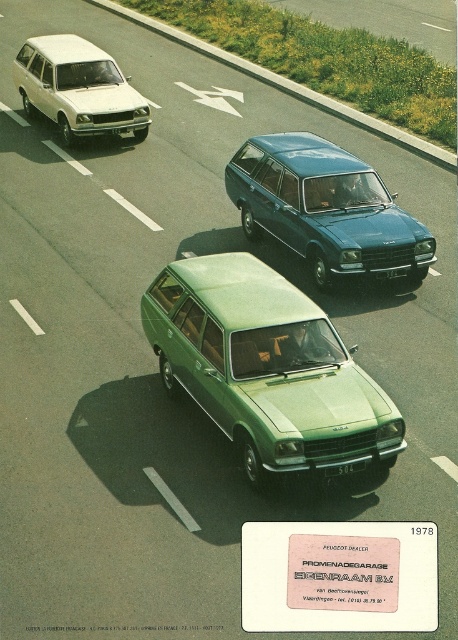
Does teal metallic station wagon at center appear on the left side of matte white station wagon at upper left?

No, teal metallic station wagon at center is not to the left of matte white station wagon at upper left.

Between teal metallic station wagon at center and matte white station wagon at upper left, which one appears on the right side from the viewer's perspective?

Positioned to the right is teal metallic station wagon at center.

Where is `teal metallic station wagon at center`? Image resolution: width=458 pixels, height=640 pixels. teal metallic station wagon at center is located at coordinates (326, 209).

Which is above, green matte station wagon at center or matte white station wagon at upper left?

Positioned higher is matte white station wagon at upper left.

Between point (299, 394) and point (64, 92), which one is positioned in front?

Point (299, 394) is more forward.

This screenshot has height=640, width=458. I want to click on green matte station wagon at center, so click(x=267, y=368).

Who is more forward, (249, 470) or (369, 184)?

Positioned in front is point (249, 470).

Can you confirm if green matte station wagon at center is bigger than teal metallic station wagon at center?

Actually, green matte station wagon at center might be smaller than teal metallic station wagon at center.

Image resolution: width=458 pixels, height=640 pixels. I want to click on green matte station wagon at center, so click(x=267, y=368).